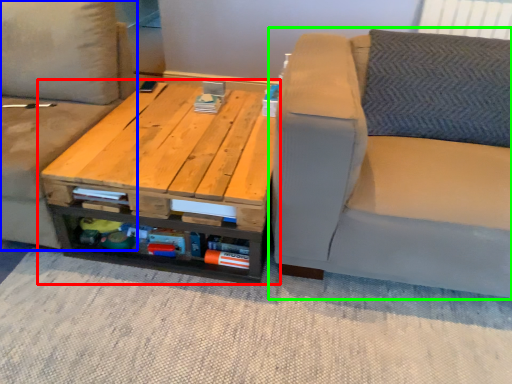
Question: Considering the real-world distances, which object is farthest from table (highlighted by a red box)? studio couch (highlighted by a blue box) or studio couch (highlighted by a green box)?

Choices:
 (A) studio couch
 (B) studio couch

Answer: (B)